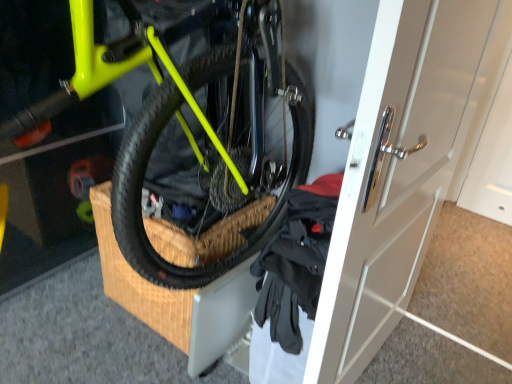
Locate an element on the screen. This screenshot has width=512, height=384. neon yellow matte bicycle at center is located at coordinates (195, 127).

Are neon yellow matte bicycle at center and black fabric gloves at lower right beside each other?

They are not placed beside each other.

Does neon yellow matte bicycle at center have a larger size compared to black fabric gloves at lower right?

Correct, neon yellow matte bicycle at center is larger in size than black fabric gloves at lower right.

In the scene shown: From a real-world perspective, is neon yellow matte bicycle at center positioned over black fabric gloves at lower right based on gravity?

Yes.

Is neon yellow matte bicycle at center inside the boundaries of black fabric gloves at lower right, or outside?

neon yellow matte bicycle at center is not enclosed by black fabric gloves at lower right.

Measure the distance between black fabric gloves at lower right and white glossy door at center.

black fabric gloves at lower right is 10.02 inches away from white glossy door at center.

Between black fabric gloves at lower right and white glossy door at center, which one has larger size?

With larger size is white glossy door at center.

Is white glossy door at center at the back of black fabric gloves at lower right?

No, black fabric gloves at lower right is not facing away from white glossy door at center.

Where is `clothing that is behind the white glossy door at center`? This screenshot has height=384, width=512. clothing that is behind the white glossy door at center is located at coordinates (296, 262).

Locate an element on the screen. Image resolution: width=512 pixels, height=384 pixels. clothing below the white glossy door at center (from the image's perspective) is located at coordinates (296, 262).

Measure the distance between white glossy door at center and black fabric gloves at lower right.

white glossy door at center is 10.02 inches from black fabric gloves at lower right.

Is white glossy door at center facing towards black fabric gloves at lower right?

Yes, white glossy door at center is aimed at black fabric gloves at lower right.

Is point (451, 3) positioned after point (280, 326)?

No, (451, 3) is in front of (280, 326).

Which object is wider, neon yellow matte bicycle at center or white glossy door at center?

neon yellow matte bicycle at center is wider.

Which point is more distant from viewer, (285,97) or (439,90)?

The point (285,97) is farther from the camera.

This screenshot has height=384, width=512. I want to click on bicycle on the left side of white glossy door at center, so click(195, 127).

Looking at this image, which is correct: neon yellow matte bicycle at center is inside white glossy door at center, or outside of it?

The correct answer is: outside.

Visually, is white glossy door at center positioned to the left or to the right of neon yellow matte bicycle at center?

white glossy door at center is positioned on neon yellow matte bicycle at center's right side.

Considering the points (327, 304) and (133, 137), which point is behind, point (327, 304) or point (133, 137)?

The point (327, 304) is farther from the camera.

How different are the orientations of white glossy door at center and neon yellow matte bicycle at center in degrees?

They differ by 88.8 degrees in their facing directions.

Identify the location of bicycle in front of the white glossy door at center. This screenshot has width=512, height=384. (195, 127).

Which object is positioned more to the left, black fabric gloves at lower right or neon yellow matte bicycle at center?

neon yellow matte bicycle at center.

Which of these two, black fabric gloves at lower right or neon yellow matte bicycle at center, is bigger?

With larger size is neon yellow matte bicycle at center.

Does point (284, 255) lie behind point (261, 122)?

No, (284, 255) is in front of (261, 122).

Considering the relative sizes of black fabric gloves at lower right and neon yellow matte bicycle at center in the image provided, is black fabric gloves at lower right thinner than neon yellow matte bicycle at center?

Yes.

You are a GUI agent. You are given a task and a screenshot of the screen. Output one action in this format:
    pyautogui.click(x=<x>, y=<y>)
    Task: Click on the bicycle above the black fabric gloves at lower right (from a real-world perspective)
    The height and width of the screenshot is (384, 512).
    Given the screenshot: What is the action you would take?
    pyautogui.click(x=195, y=127)

Locate an element on the screen. This screenshot has height=384, width=512. door in front of the black fabric gloves at lower right is located at coordinates (403, 167).

Looking at the image, which one is located closer to neon yellow matte bicycle at center, white glossy door at center or black fabric gloves at lower right?

Among the two, black fabric gloves at lower right is located nearer to neon yellow matte bicycle at center.

From the image, which object appears to be nearer to black fabric gloves at lower right, neon yellow matte bicycle at center or white glossy door at center?

The object closer to black fabric gloves at lower right is white glossy door at center.

When comparing their distances from white glossy door at center, does neon yellow matte bicycle at center or black fabric gloves at lower right seem further?

Among the two, neon yellow matte bicycle at center is located further to white glossy door at center.

Which object lies further to the anchor point neon yellow matte bicycle at center, black fabric gloves at lower right or white glossy door at center?

white glossy door at center lies further to neon yellow matte bicycle at center than the other object.

When comparing their distances from black fabric gloves at lower right, does white glossy door at center or neon yellow matte bicycle at center seem further?

Among the two, neon yellow matte bicycle at center is located further to black fabric gloves at lower right.

Looking at the image, which one is located closer to white glossy door at center, black fabric gloves at lower right or neon yellow matte bicycle at center?

Among the two, black fabric gloves at lower right is located nearer to white glossy door at center.

Where is `clothing between neon yellow matte bicycle at center and white glossy door at center in the horizontal direction`? The height and width of the screenshot is (384, 512). clothing between neon yellow matte bicycle at center and white glossy door at center in the horizontal direction is located at coordinates (296, 262).